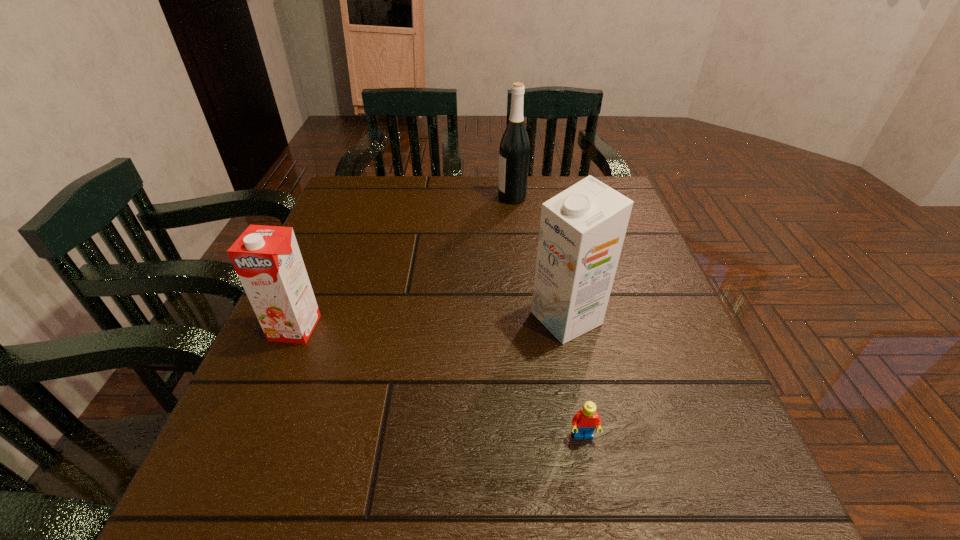
Where is `vacant region between the nearest object and the leftmost object`? Image resolution: width=960 pixels, height=540 pixels. vacant region between the nearest object and the leftmost object is located at coordinates (439, 382).

Find the location of `free space between the wine bottle and the third tallest object`. free space between the wine bottle and the third tallest object is located at coordinates (403, 262).

Where is `unoccupied position between the leftmost object and the farthest object`? unoccupied position between the leftmost object and the farthest object is located at coordinates (403, 262).

At what (x,y) coordinates should I click in order to perform the action: click on unoccupied area between the third tallest object and the Lego. Please return your answer as a coordinate pair (x, y). This screenshot has height=540, width=960. Looking at the image, I should click on (439, 382).

This screenshot has height=540, width=960. I want to click on free area in between the shortest object and the taller carton, so click(574, 377).

Identify which object is located as the second nearest to the farthest object. Please provide its 2D coordinates. Your answer should be formatted as a tuple, i.e. [(x, y)], where the tuple contains the x and y coordinates of a point satisfying the conditions above.

[(267, 259)]

Locate an element on the screen. object identified as the third closest to the right carton is located at coordinates (267, 259).

Where is `vacant area that satisfies the following two spatial constraints: 1. on the label of the farthest object; 2. on the right side of the right carton`? vacant area that satisfies the following two spatial constraints: 1. on the label of the farthest object; 2. on the right side of the right carton is located at coordinates (525, 318).

This screenshot has height=540, width=960. What are the coordinates of `free spot that satisfies the following two spatial constraints: 1. on the label of the right carton; 2. on the right side of the farthest object` in the screenshot? It's located at (525, 318).

You are a GUI agent. You are given a task and a screenshot of the screen. Output one action in this format:
    pyautogui.click(x=<x>, y=<y>)
    Task: Click on the free space that satisfies the following two spatial constraints: 1. on the back side of the taller carton; 2. on the label of the farthest object
    The height and width of the screenshot is (540, 960).
    Given the screenshot: What is the action you would take?
    (541, 198)